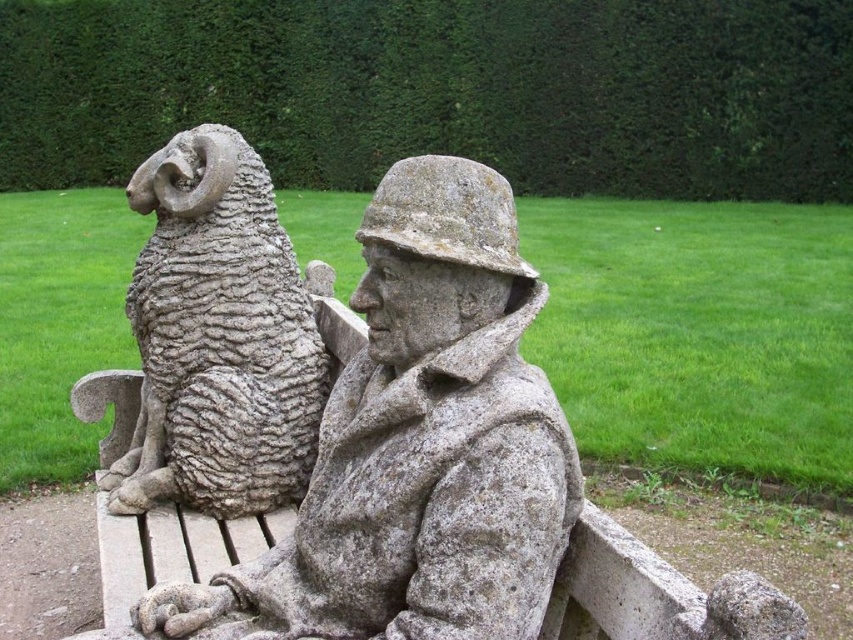
Question: Does granite statue at center have a larger size compared to gray stone ram at left?

Choices:
 (A) yes
 (B) no

Answer: (B)

Question: Which point is farther to the camera?

Choices:
 (A) granite statue at center
 (B) gray stone ram at left

Answer: (B)

Question: In this image, where is granite statue at center located relative to gray stone ram at left?

Choices:
 (A) left
 (B) right

Answer: (B)

Question: Which point is farther to the camera?

Choices:
 (A) gray stone ram at left
 (B) granite statue at center

Answer: (A)

Question: Can you confirm if granite statue at center is positioned to the right of gray stone ram at left?

Choices:
 (A) no
 (B) yes

Answer: (B)